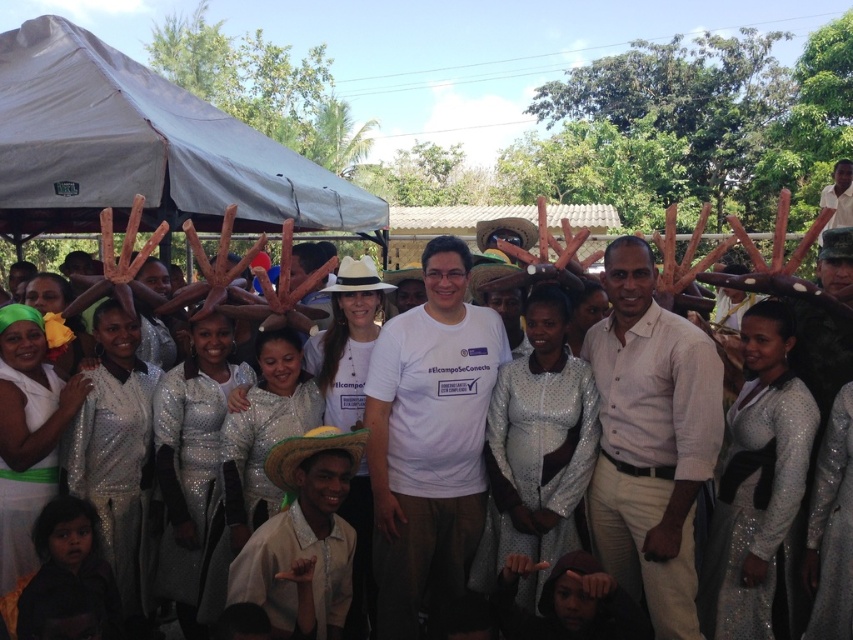
Question: Among these points, which one is nearest to the camera?

Choices:
 (A) (186, 147)
 (B) (477, 337)
 (C) (666, 572)

Answer: (C)

Question: Does white fabric canopy at upper left have a lesser width compared to white matte t-shirt at center?

Choices:
 (A) no
 (B) yes

Answer: (B)

Question: Which point is farther to the camera?

Choices:
 (A) (595, 346)
 (B) (369, 460)

Answer: (A)

Question: Is white fabric canopy at upper left in front of light beige cotton shirt at center?

Choices:
 (A) no
 (B) yes

Answer: (A)

Question: Which of the following is the closest to the observer?

Choices:
 (A) white matte t-shirt at center
 (B) white fabric canopy at upper left
 (C) light beige cotton shirt at center

Answer: (C)

Question: Does white fabric canopy at upper left have a greater width compared to light beige cotton shirt at center?

Choices:
 (A) yes
 (B) no

Answer: (B)